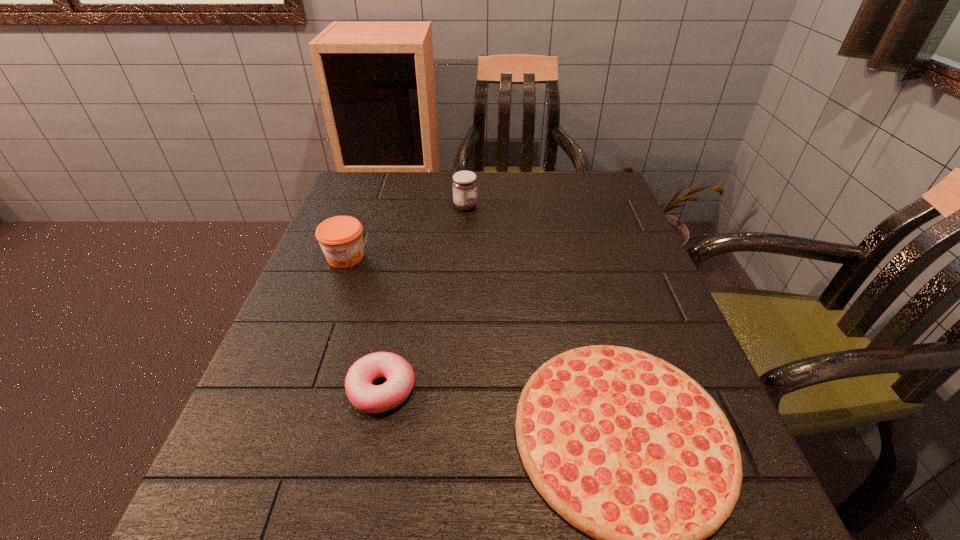
The height and width of the screenshot is (540, 960). What are the coordinates of `jam located at the left edge` in the screenshot? It's located at (341, 239).

At what (x,y) coordinates should I click in order to perform the action: click on doughnut present at the left edge. Please return your answer as a coordinate pair (x, y). The height and width of the screenshot is (540, 960). Looking at the image, I should click on (400, 376).

The height and width of the screenshot is (540, 960). I want to click on vacant space at the far edge, so click(x=497, y=172).

Where is `vacant space at the near edge of the desktop`? This screenshot has width=960, height=540. vacant space at the near edge of the desktop is located at coordinates (417, 525).

In the image, there is a desktop. Where is `free region at the left edge`? The image size is (960, 540). free region at the left edge is located at coordinates (318, 314).

Locate an element on the screen. The width and height of the screenshot is (960, 540). vacant space at the right edge of the desktop is located at coordinates click(602, 285).

Locate an element on the screen. The width and height of the screenshot is (960, 540). vacant space at the near left corner is located at coordinates (294, 516).

In the image, there is a desktop. Where is `vacant space at the far right corner`? Image resolution: width=960 pixels, height=540 pixels. vacant space at the far right corner is located at coordinates (596, 198).

You are a GUI agent. You are given a task and a screenshot of the screen. Output one action in this format:
    pyautogui.click(x=<x>, y=<y>)
    Task: Click on the vacant area that lies between the farthest object and the third nearest object
    This screenshot has height=540, width=960.
    Given the screenshot: What is the action you would take?
    pos(405,232)

Locate an element on the screen. This screenshot has height=540, width=960. free space that is in between the right jam and the doughnut is located at coordinates (423, 298).